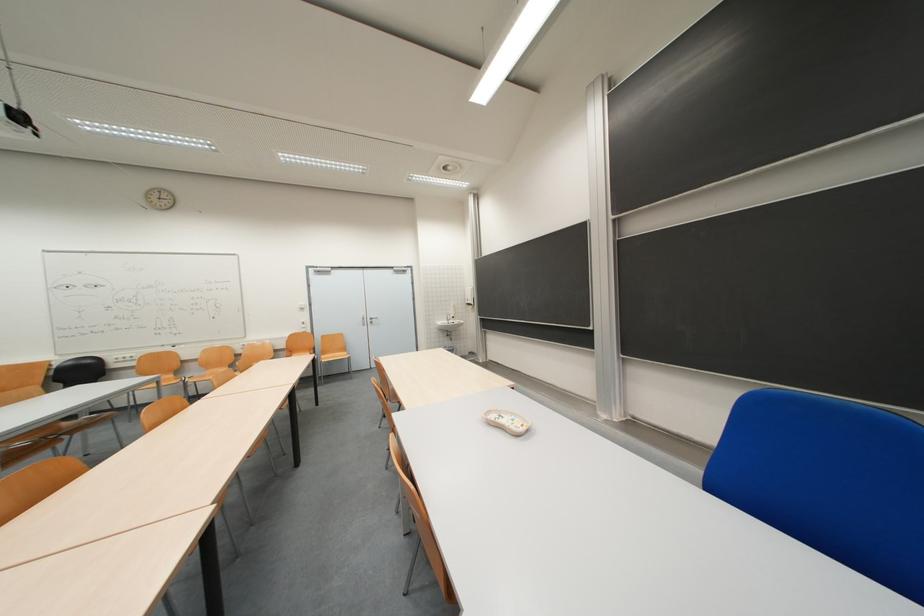
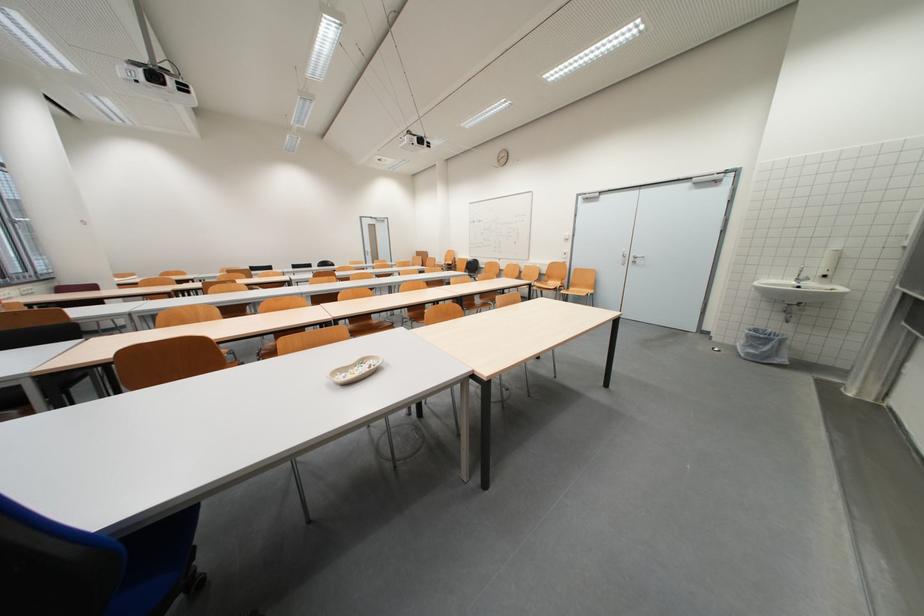
Where in the second image is the point corresponding to the point at 371,318 from the first image?

(633, 254)